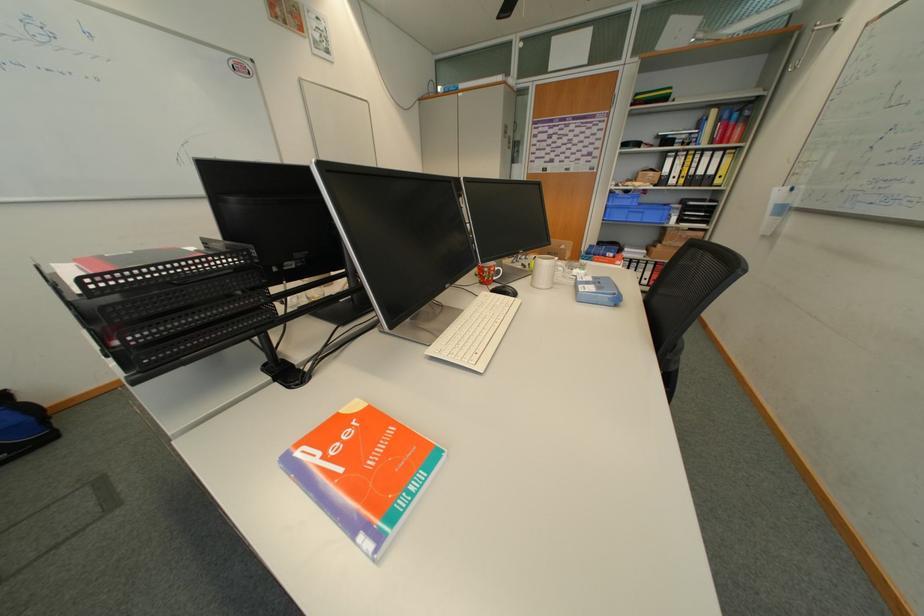
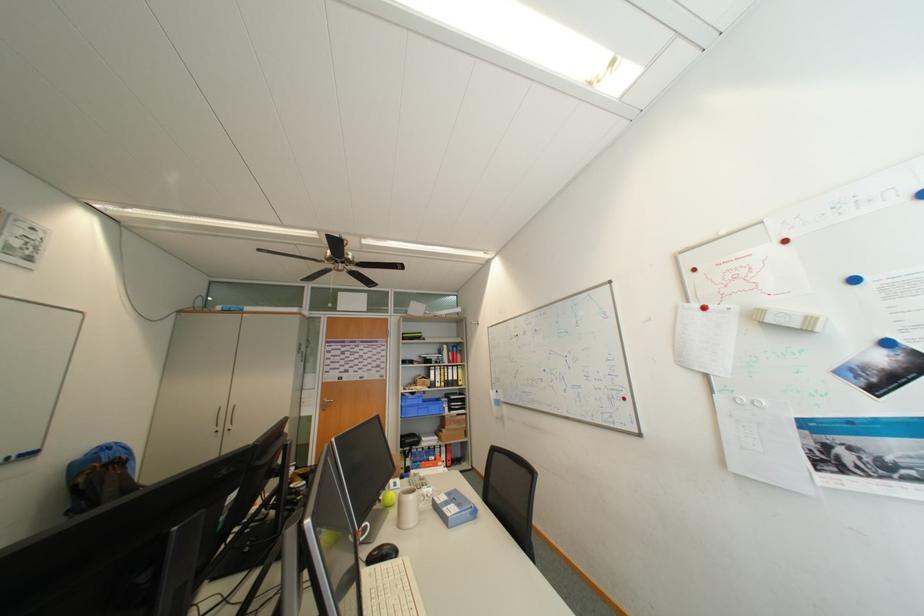
Locate, in the second image, the point that corresponds to (637,204) in the first image.

(426, 403)